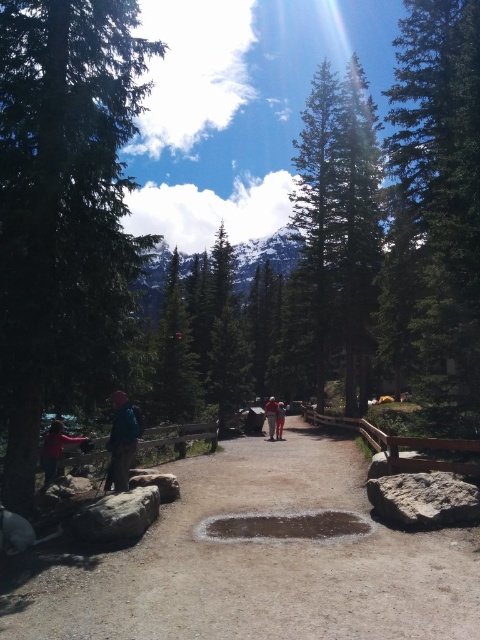
You are standing at the starting point of the pathway and want to find the matte pink jacket at lower left. According to the coordinates provided, where exactly should you look relative to your position?

The matte pink jacket at lower left is located at point coordinates 0.703 on the x axis and 0.115 on the y axis, so you should look towards the lower left direction from your current position on the pathway.

You are standing at the point labeled as point (262, 563) on the dirt path at center. Which direction should you walk to reach the wooden railings on the left side of the path?

Since the point (262, 563) is on the dirt path at center, walking to the left would lead you towards the wooden railings on the left side of the path.

Based on the photo, you are a photographer planning to capture a group photo of the matte pink jacket at lower left and the orange fabric jacket at center. Since you want both subjects to appear balanced in the frame, which jacket should you move closer to the camera to achieve this?

The matte pink jacket at lower left is smaller than the orange fabric jacket at center. To balance their sizes in the photo, move the matte pink jacket at lower left closer to the camera so it appears larger in the frame.